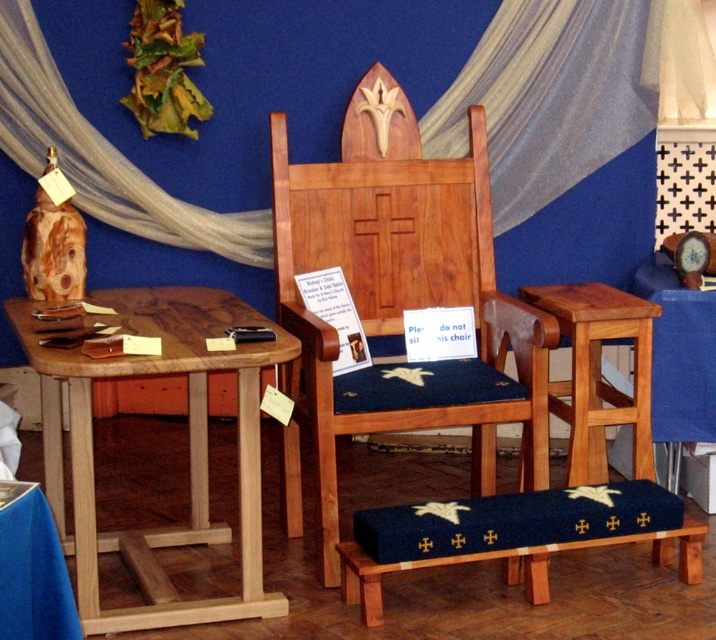
You are arranging a small event and need to place a 1.5 meter long tablecloth on the natural wood table at left and the wooden table at right. Based on the scene description, which table will the tablecloth fit better on?

The natural wood table at left has a larger size compared to wooden table at right. Since the tablecloth is 1.5 meters long, it will fit better on the larger natural wood table at left as it can accommodate the length more appropriately.

You are a delivery person who needs to place a 16 inch wide package between the wooden chair at center and the wooden table at right. Can you fit the package between them?

The distance between the wooden chair at center and the wooden table at right is 15.83 inches, which is slightly less than the 16 inch width of the package. Therefore, the package cannot fit between them.